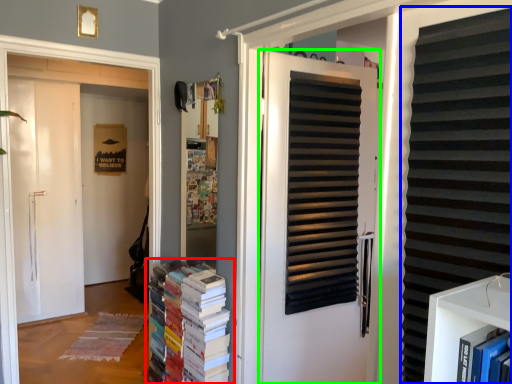
Question: Which object is positioned farthest from book (highlighted by a red box)? Select from shutter (highlighted by a blue box) and door (highlighted by a green box).

Choices:
 (A) shutter
 (B) door

Answer: (A)